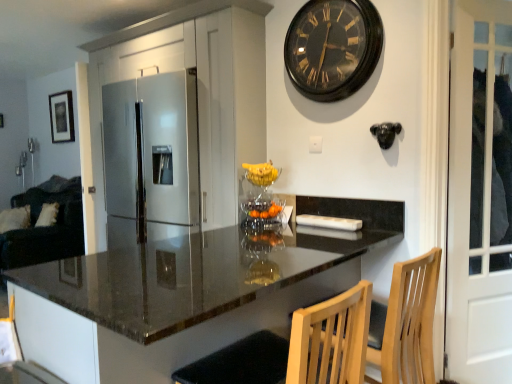
Describe the element at coordinates (296, 348) in the screenshot. I see `wooden swivel chair at lower right` at that location.

Identify the location of polished granite countertop at center. (185, 275).

At what (x,y) coordinates should I click in order to perform the action: click on black matte picture frame at upper left. Please return your answer as a coordinate pair (x, y). The width and height of the screenshot is (512, 384). Looking at the image, I should click on (61, 117).

Find the location of a particular element. black wooden clock at upper center is located at coordinates (333, 48).

Identify the location of wooden swivel chair at lower right. (296, 348).

Considering the positions of objects velvet dark green couch at left and polished granite countertop at center in the image provided, who is in front, velvet dark green couch at left or polished granite countertop at center?

polished granite countertop at center is in front.

Is the surface of velvet dark green couch at left in direct contact with polished granite countertop at center?

No.

From a real-world perspective, which is physically below, velvet dark green couch at left or polished granite countertop at center?

velvet dark green couch at left is physically lower.

Can you confirm if velvet dark green couch at left is positioned to the left of polished granite countertop at center?

Yes.

Is wooden swivel chair at lower right to the left of velvet dark green couch at left from the viewer's perspective?

Incorrect, wooden swivel chair at lower right is not on the left side of velvet dark green couch at left.

Does wooden swivel chair at lower right turn towards velvet dark green couch at left?

Yes, wooden swivel chair at lower right is turned towards velvet dark green couch at left.

Which object is thinner, wooden swivel chair at lower right or velvet dark green couch at left?

Thinner between the two is wooden swivel chair at lower right.

From the image's perspective, does wooden swivel chair at lower right appear higher than velvet dark green couch at left?

No, from the image's perspective, wooden swivel chair at lower right is not over velvet dark green couch at left.

Consider the image. Considering the relative sizes of velvet dark green couch at left and wooden swivel chair at lower right in the image provided, is velvet dark green couch at left taller than wooden swivel chair at lower right?

Yes, velvet dark green couch at left is taller than wooden swivel chair at lower right.

From a real-world perspective, who is located lower, velvet dark green couch at left or wooden swivel chair at lower right?

velvet dark green couch at left, from a real-world perspective.

From the image's perspective, which one is positioned lower, velvet dark green couch at left or wooden swivel chair at lower right?

wooden swivel chair at lower right appears lower in the image.

Is velvet dark green couch at left next to wooden swivel chair at lower right?

No, velvet dark green couch at left is not touching wooden swivel chair at lower right.

Considering the positions of objects polished granite countertop at center and black matte picture frame at upper left in the image provided, who is more to the left, polished granite countertop at center or black matte picture frame at upper left?

black matte picture frame at upper left.

Is polished granite countertop at center not near black matte picture frame at upper left?

Yes, polished granite countertop at center is far from black matte picture frame at upper left.

Is polished granite countertop at center situated inside black matte picture frame at upper left or outside?

polished granite countertop at center exists outside the volume of black matte picture frame at upper left.

Considering the relative positions of wooden swivel chair at lower right and polished granite countertop at center in the image provided, is wooden swivel chair at lower right behind polished granite countertop at center?

Yes, the depth of wooden swivel chair at lower right is greater than that of polished granite countertop at center.

Is wooden swivel chair at lower right not inside polished granite countertop at center?

Actually, wooden swivel chair at lower right is within polished granite countertop at center.

In the image, is wooden swivel chair at lower right on the left side or the right side of polished granite countertop at center?

wooden swivel chair at lower right is to the right of polished granite countertop at center.

Does point (266, 11) come behind point (351, 79)?

Yes, it is behind point (351, 79).

At what (x,y) coordinates should I click in order to perform the action: click on wall clock lying on the right of satin silver refrigerator at center. Please return your answer as a coordinate pair (x, y). Looking at the image, I should click on (333, 48).

Considering the positions of objects satin silver refrigerator at center and black wooden clock at upper center in the image provided, who is in front, satin silver refrigerator at center or black wooden clock at upper center?

black wooden clock at upper center is closer to the camera.

Is wooden swivel chair at lower right situated inside black wooden clock at upper center or outside?

wooden swivel chair at lower right cannot be found inside black wooden clock at upper center.

Which is less distant, [262,362] or [349,65]?

Point [262,362].

How much distance is there between wooden swivel chair at lower right and black wooden clock at upper center?

wooden swivel chair at lower right and black wooden clock at upper center are 1.45 meters apart.

Which object is further away from the camera taking this photo, wooden swivel chair at lower right or black wooden clock at upper center?

black wooden clock at upper center is further from the camera.

Find the location of a particular element. Image resolution: width=512 pixels, height=384 pixels. couch on the left of polished granite countertop at center is located at coordinates (46, 227).

Find the location of a particular element. swivel chair above the velvet dark green couch at left (from a real-world perspective) is located at coordinates (296, 348).

When comparing their distances from wooden swivel chair at lower right, does black wooden clock at upper center or velvet dark green couch at left seem closer?

black wooden clock at upper center is positioned closer to the anchor wooden swivel chair at lower right.

Estimate the real-world distances between objects in this image. Which object is further from polished granite countertop at center, satin silver refrigerator at center or velvet dark green couch at left?

velvet dark green couch at left is further to polished granite countertop at center.

Estimate the real-world distances between objects in this image. Which object is closer to wooden swivel chair at lower right, velvet dark green couch at left or satin silver refrigerator at center?

satin silver refrigerator at center.

When comparing their distances from white glass door at right, does black wooden clock at upper center or satin silver refrigerator at center seem closer?

Among the two, black wooden clock at upper center is located nearer to white glass door at right.

From the image, which object appears to be farther from wooden swivel chair at lower right, velvet dark green couch at left or white glass door at right?

velvet dark green couch at left lies further to wooden swivel chair at lower right than the other object.

Which object lies nearer to the anchor point wooden swivel chair at lower right, white glass door at right or satin silver refrigerator at center?

Among the two, white glass door at right is located nearer to wooden swivel chair at lower right.

From the image, which object appears to be nearer to black wooden clock at upper center, satin silver refrigerator at center or white glass door at right?

satin silver refrigerator at center is closer to black wooden clock at upper center.

Considering their positions, is velvet dark green couch at left positioned closer to satin silver refrigerator at center than black matte picture frame at upper left?

velvet dark green couch at left is closer to satin silver refrigerator at center.

You are a GUI agent. You are given a task and a screenshot of the screen. Output one action in this format:
    pyautogui.click(x=<x>, y=<y>)
    Task: Click on the wall clock positioned between polished granite countertop at center and black matte picture frame at upper left from near to far
    
    Given the screenshot: What is the action you would take?
    pyautogui.click(x=333, y=48)

Where is `cabinetry between black matte picture frame at upper left and white glass door at right`? The image size is (512, 384). cabinetry between black matte picture frame at upper left and white glass door at right is located at coordinates (197, 88).

Locate an element on the screen. Image resolution: width=512 pixels, height=384 pixels. couch between satin silver refrigerator at center and black matte picture frame at upper left from front to back is located at coordinates (46, 227).

Identify the location of screen door between polished granite countertop at center and black matte picture frame at upper left in the front-back direction. Image resolution: width=512 pixels, height=384 pixels. (480, 195).